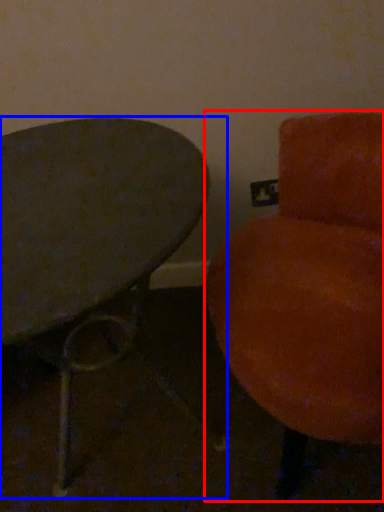
Question: Which object appears closest to the camera in this image, chair (highlighted by a red box) or table (highlighted by a blue box)?

Choices:
 (A) chair
 (B) table

Answer: (A)